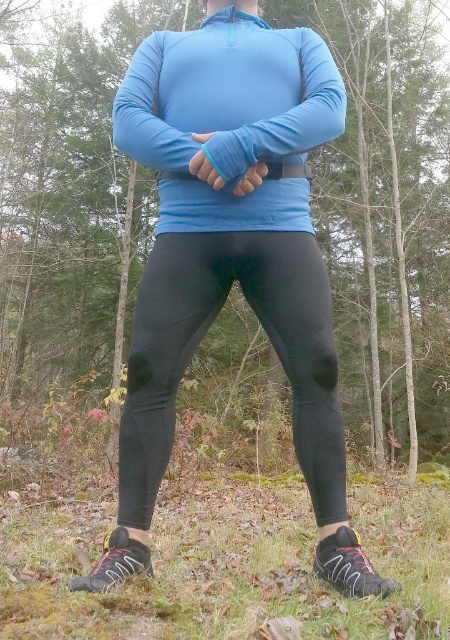
You are a photographer setting up a shoot in the forest. You notice two pairs of leggings worn by the model. Which leggings are positioned to the left of the other? The leggings in question are the matte black leggings at center and the black matte leggings at center.

The matte black leggings at center are positioned to the left of the black matte leggings at center.

You are navigating through the forest and need to reach a specific location marked by the point at (296, 132). There is another point at (426, 440) in your path. Which point should you avoid to stay on the correct path?

You should avoid the point at (426, 440) because it is behind the point at (296, 132), meaning it is further away from your current position and not part of the direct path.

You are a photographer trying to capture the matte black leggings at center in your shot. The camera you are using has a focal point grid divided into 9 equal squares. Where should you position the focal point on the grid to ensure the leggings are centered in your photo?

Since the matte black leggings at center are located at point coordinates of 0.333 on the x axis and 0.156 on the y axis, the focal point should be placed at the intersection of the left vertical line and the lower horizontal line of the 3x3 grid to center the leggings in the photo.